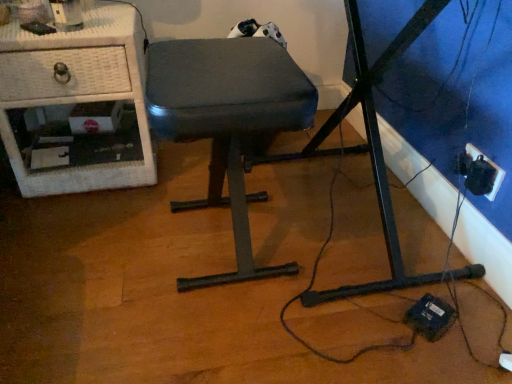
What do you see at coordinates (80, 99) in the screenshot?
I see `white wicker nightstand at left` at bounding box center [80, 99].

At what (x,y) coordinates should I click in order to perform the action: click on black plastic outlet at lower right. Please return your answer as a coordinate pair (x, y). This screenshot has width=512, height=384. Looking at the image, I should click on (479, 172).

Describe the element at coordinates (479, 172) in the screenshot. I see `black plastic outlet at lower right` at that location.

Identify the location of white wicker nightstand at left. The height and width of the screenshot is (384, 512). (80, 99).

From the image's perspective, who appears lower, white wicker nightstand at left or black plastic outlet at lower right?

black plastic outlet at lower right appears lower in the image.

From their relative heights in the image, would you say white wicker nightstand at left is taller or shorter than black plastic outlet at lower right?

white wicker nightstand at left is taller than black plastic outlet at lower right.

From a real-world perspective, is white wicker nightstand at left positioned over black plastic outlet at lower right based on gravity?

Yes, from a real-world perspective, white wicker nightstand at left is above black plastic outlet at lower right.

Which object is wider, white wicker nightstand at left or black plastic outlet at lower right?

white wicker nightstand at left is wider.

Which object is closer to the camera, black plastic outlet at lower right or white wicker nightstand at left?

black plastic outlet at lower right is more forward.

Which is behind, point (455, 168) or point (132, 176)?

Point (132, 176)

Is white wicker nightstand at left a part of black plastic outlet at lower right?

No, white wicker nightstand at left is not surrounded by black plastic outlet at lower right.

Is white wicker nightstand at left bigger or smaller than dark gray fabric stool at center?

Considering their sizes, white wicker nightstand at left takes up more space than dark gray fabric stool at center.

Considering the points (117, 170) and (234, 175), which point is in front, point (117, 170) or point (234, 175)?

Positioned in front is point (234, 175).

Does dark gray fabric stool at center appear on the right side of black plastic outlet at lower right?

No, dark gray fabric stool at center is not to the right of black plastic outlet at lower right.

Considering the relative positions of dark gray fabric stool at center and black plastic outlet at lower right in the image provided, is dark gray fabric stool at center in front of black plastic outlet at lower right?

Yes, dark gray fabric stool at center is closer to the camera.

Measure the distance between dark gray fabric stool at center and black plastic outlet at lower right.

The distance of dark gray fabric stool at center from black plastic outlet at lower right is 25.08 inches.

Could you tell me if dark gray fabric stool at center is facing black plastic outlet at lower right?

No.

Considering the sizes of objects black plastic outlet at lower right and dark gray fabric stool at center in the image provided, who is wider, black plastic outlet at lower right or dark gray fabric stool at center?

Wider between the two is dark gray fabric stool at center.

Based on the photo, does black plastic outlet at lower right turn towards dark gray fabric stool at center?

Yes, black plastic outlet at lower right is facing dark gray fabric stool at center.

In the image, is black plastic outlet at lower right positioned in front of or behind dark gray fabric stool at center?

Clearly, black plastic outlet at lower right is behind dark gray fabric stool at center.

Which object is positioned more to the right, black plastic outlet at lower right or dark gray fabric stool at center?

black plastic outlet at lower right is more to the right.

Which point is more forward, [259,81] or [120,27]?

Point [259,81]

Is the surface of dark gray fabric stool at center in direct contact with white wicker nightstand at left?

No, dark gray fabric stool at center is not making contact with white wicker nightstand at left.

Is dark gray fabric stool at center smaller than white wicker nightstand at left?

Yes.

Does dark gray fabric stool at center have a lesser height compared to white wicker nightstand at left?

No.

Where is `furniture behind the black plastic outlet at lower right`? This screenshot has height=384, width=512. furniture behind the black plastic outlet at lower right is located at coordinates (80, 99).

The height and width of the screenshot is (384, 512). Find the location of `electric outlet that is below the white wicker nightstand at left (from the image's perspective)`. electric outlet that is below the white wicker nightstand at left (from the image's perspective) is located at coordinates (479, 172).

When comparing their distances from white wicker nightstand at left, does dark gray fabric stool at center or black plastic outlet at lower right seem further?

black plastic outlet at lower right.

Looking at the image, which one is located closer to dark gray fabric stool at center, black plastic outlet at lower right or white wicker nightstand at left?

Based on the image, white wicker nightstand at left appears to be nearer to dark gray fabric stool at center.

Looking at the image, which one is located closer to white wicker nightstand at left, black plastic outlet at lower right or dark gray fabric stool at center?

dark gray fabric stool at center.

When comparing their distances from black plastic outlet at lower right, does white wicker nightstand at left or dark gray fabric stool at center seem further?

white wicker nightstand at left.

Estimate the real-world distances between objects in this image. Which object is further from black plastic outlet at lower right, dark gray fabric stool at center or white wicker nightstand at left?

white wicker nightstand at left is positioned further to the anchor black plastic outlet at lower right.

Based on their spatial positions, is white wicker nightstand at left or black plastic outlet at lower right closer to dark gray fabric stool at center?

white wicker nightstand at left.

Find the location of `stool located between white wicker nightstand at left and black plastic outlet at lower right in the left-right direction`. stool located between white wicker nightstand at left and black plastic outlet at lower right in the left-right direction is located at coordinates (227, 121).